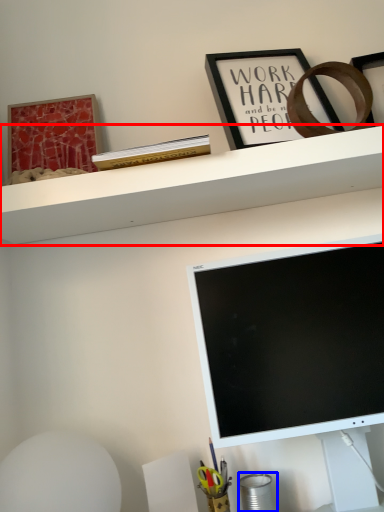
Question: Which point is closer to the camera, shelf (highlighted by a red box) or stationery (highlighted by a blue box)?

Choices:
 (A) shelf
 (B) stationery

Answer: (A)